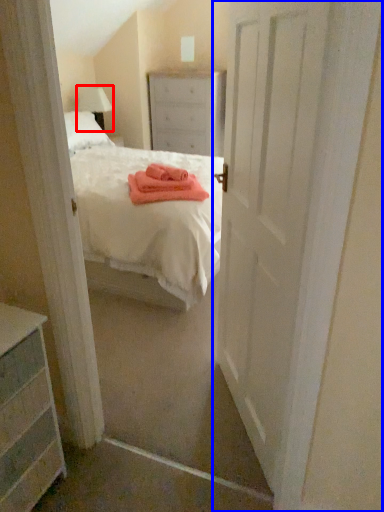
Question: Which of the following is the farthest to the observer, lamp (highlighted by a red box) or door (highlighted by a blue box)?

Choices:
 (A) lamp
 (B) door

Answer: (A)